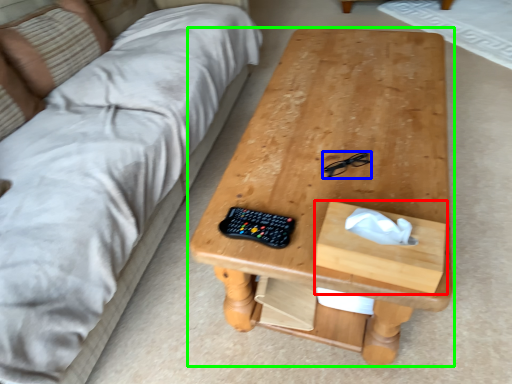
Question: Estimate the real-world distances between objects in this image. Which object is closer to drawer (highlighted by a red box), glasses (highlighted by a blue box) or table (highlighted by a green box)?

Choices:
 (A) glasses
 (B) table

Answer: (A)